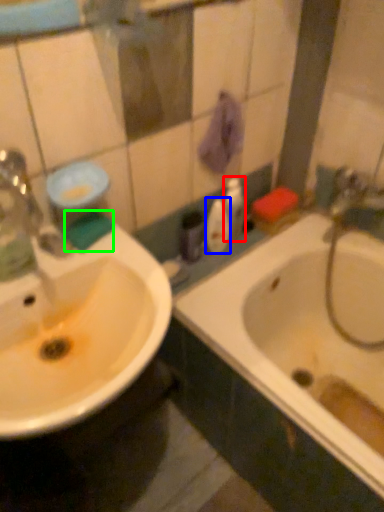
Question: Based on their relative distances, which object is nearer to toiletry (highlighted by a red box)? Choose from mouthwash (highlighted by a blue box) and liquid (highlighted by a green box).

Choices:
 (A) mouthwash
 (B) liquid

Answer: (A)